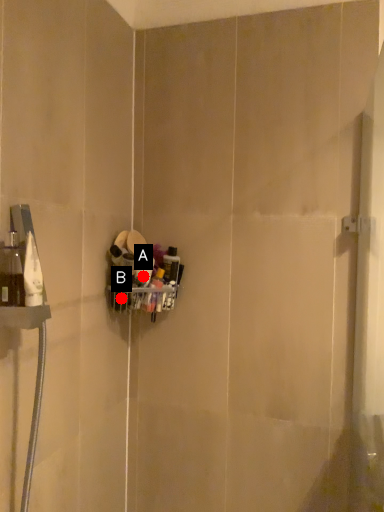
Question: Two points are circled on the image, labeled by A and B beside each circle. Which point is farther from the camera taking this photo?

Choices:
 (A) A is further
 (B) B is further

Answer: (B)